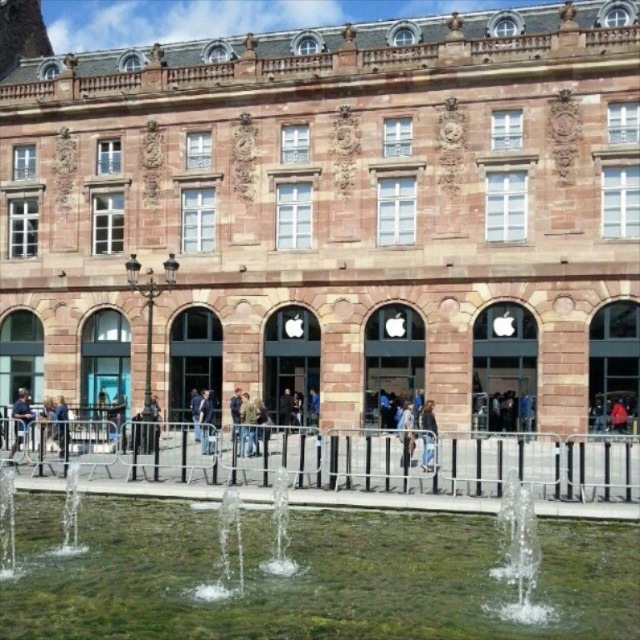
Question: Which point is closer to the camera taking this photo?

Choices:
 (A) (26, 394)
 (B) (342, 477)
 (C) (524, 500)
 (D) (280, 620)

Answer: (D)

Question: Can you confirm if clear water at center is positioned to the left of blue denim jeans at center?

Choices:
 (A) yes
 (B) no

Answer: (B)

Question: Is green stone fountain at lower center positioned behind light brown leather jacket at center?

Choices:
 (A) yes
 (B) no

Answer: (B)

Question: Can you confirm if clear water at center is thinner than clear glass water at lower center?

Choices:
 (A) no
 (B) yes

Answer: (A)

Question: Which of the following is the farthest from the observer?

Choices:
 (A) clear glass water at lower center
 (B) dark blue fabric at center
 (C) clear water at center

Answer: (B)

Question: Among these points, which one is nearest to the camera?

Choices:
 (A) (67, 438)
 (B) (138, 570)
 (C) (433, 433)
 (D) (506, 538)

Answer: (B)